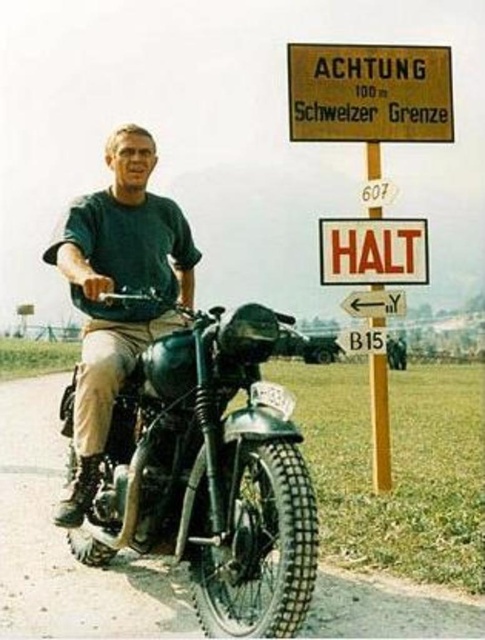
Does shiny black motorcycle at center have a lesser width compared to green matte shirt at center?

No.

Find the location of a particular element. This screenshot has width=485, height=640. shiny black motorcycle at center is located at coordinates (210, 474).

Between shiny black motorcycle at center and orange plastic sign at center, which one is positioned lower?

shiny black motorcycle at center

Does shiny black motorcycle at center have a smaller size compared to orange plastic sign at center?

Incorrect, shiny black motorcycle at center is not smaller in size than orange plastic sign at center.

Is point (278, 472) closer to camera compared to point (356, 280)?

Yes, point (278, 472) is in front of point (356, 280).

Where is `shiny black motorcycle at center`? Image resolution: width=485 pixels, height=640 pixels. shiny black motorcycle at center is located at coordinates (x=210, y=474).

In the scene shown: Can you confirm if shiny black motorcycle at center is thinner than yellow cardboard sign at upper center?

No, shiny black motorcycle at center is not thinner than yellow cardboard sign at upper center.

Is point (291, 320) behind point (313, 83)?

No, (291, 320) is closer to viewer.

This screenshot has width=485, height=640. I want to click on shiny black motorcycle at center, so click(210, 474).